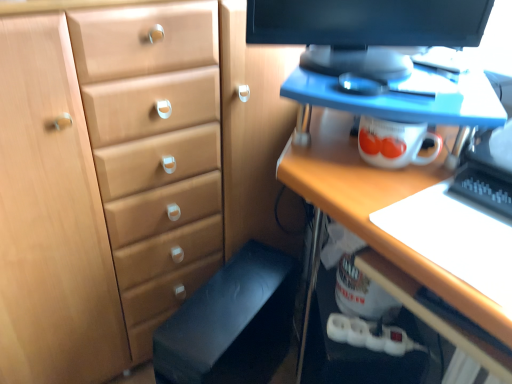
Locate an element on the screen. Image resolution: width=512 pixels, height=384 pixels. free space in front of black glossy monitor at upper center is located at coordinates (389, 94).